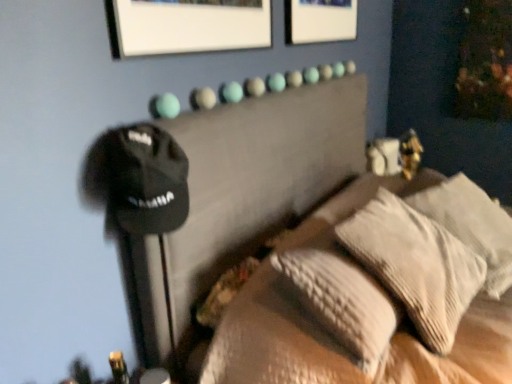
Question: Is point (347, 140) closer or farther from the camera than point (420, 281)?

Choices:
 (A) closer
 (B) farther

Answer: (B)

Question: Relative to textured beige pillow at center, the second pillow from the right, is black fabric bed at upper center in front or behind?

Choices:
 (A) behind
 (B) front

Answer: (B)

Question: Estimate the real-world distances between objects in this image. Which object is closer to the textured beige pillow at center, which is the first pillow from left to right?

Choices:
 (A) textured beige pillows at center
 (B) black fabric bed at upper center
 (C) white textured pillow at right, the first pillow positioned from the right

Answer: (A)

Question: Which object is the closest to the textured beige pillow at center, the second pillow from the right?

Choices:
 (A) textured beige pillows at center
 (B) white textured pillow at right, which is the second pillow from left to right
 (C) black fabric bed at upper center

Answer: (A)